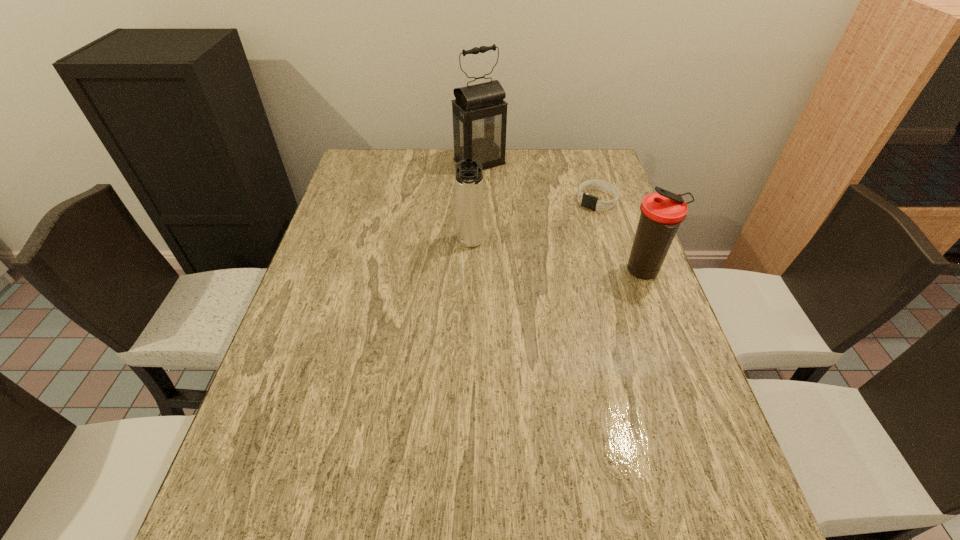
In the image, there is a desktop. Identify the location of free space at the right edge. pyautogui.click(x=607, y=258).

Identify the location of free space at the far right corner of the desktop. Image resolution: width=960 pixels, height=540 pixels. (572, 149).

Where is `free space that is in between the right thermos bottle and the farthest object`? The height and width of the screenshot is (540, 960). free space that is in between the right thermos bottle and the farthest object is located at coordinates (562, 217).

Locate an element on the screen. free area in between the tallest object and the second farthest object is located at coordinates (539, 181).

Identify the location of empty location between the wristband and the lantern. Image resolution: width=960 pixels, height=540 pixels. (539, 181).

Find the location of a particular element. unoccupied position between the right thermos bottle and the farthest object is located at coordinates (562, 217).

Locate an element on the screen. free space between the shortest object and the right thermos bottle is located at coordinates (x=620, y=236).

The width and height of the screenshot is (960, 540). I want to click on object that can be found as the closest to the third nearest object, so click(661, 213).

Identify which object is located as the nearest to the left thermos bottle. Please provide its 2D coordinates. Your answer should be formatted as a tuple, i.e. [(x, y)], where the tuple contains the x and y coordinates of a point satisfying the conditions above.

[(479, 112)]

You are a GUI agent. You are given a task and a screenshot of the screen. Output one action in this format:
    pyautogui.click(x=<x>, y=<y>)
    Task: Click on the vacant region that satisfies the following two spatial constraints: 1. on the handle side of the right thermos bottle; 2. on the right side of the left thermos bottle
    
    Given the screenshot: What is the action you would take?
    pyautogui.click(x=469, y=272)